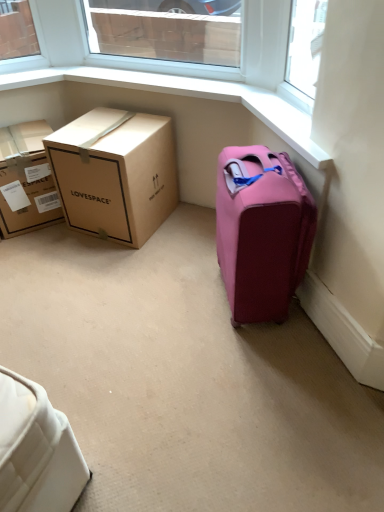
Identify the location of clear glass window at upper center. (166, 33).

Describe the element at coordinates (26, 180) in the screenshot. The width and height of the screenshot is (384, 512). I see `brown cardboard box at left, which appears as the first box when viewed from the left` at that location.

You are a GUI agent. You are given a task and a screenshot of the screen. Output one action in this format:
    pyautogui.click(x=<x>, y=<y>)
    Task: Click on the clear glass window at upper center
    This screenshot has width=384, height=512.
    Given the screenshot: What is the action you would take?
    pyautogui.click(x=166, y=33)

From a real-world perspective, who is located higher, brown cardboard box at left, which is counted as the first box, starting from the right, or pink fabric suitcase at right?

From a 3D spatial view, pink fabric suitcase at right is above.

Based on their positions, is brown cardboard box at left, placed as the second box when sorted from left to right, located to the left or right of pink fabric suitcase at right?

Based on their positions, brown cardboard box at left, placed as the second box when sorted from left to right, is located to the left of pink fabric suitcase at right.

Which of these two, brown cardboard box at left, placed as the second box when sorted from left to right, or pink fabric suitcase at right, is wider?

brown cardboard box at left, placed as the second box when sorted from left to right.

Is brown cardboard box at left, which is counted as the first box, starting from the right, bigger than pink fabric suitcase at right?

Yes, brown cardboard box at left, which is counted as the first box, starting from the right, is bigger than pink fabric suitcase at right.

From the image's perspective, which object appears higher, clear glass window at upper center or brown cardboard box at left, the second box from the right?

clear glass window at upper center is shown above in the image.

Considering the relative positions of clear glass window at upper center and brown cardboard box at left, the second box from the right, in the image provided, is clear glass window at upper center behind brown cardboard box at left, the second box from the right,?

No, clear glass window at upper center is closer to the camera.

Is clear glass window at upper center not within brown cardboard box at left, which appears as the first box when viewed from the left?

clear glass window at upper center is positioned outside brown cardboard box at left, which appears as the first box when viewed from the left.

Between point (232, 6) and point (247, 154), which one is positioned behind?

Point (232, 6)

Is clear glass window at upper center facing towards pink fabric suitcase at right?

No, clear glass window at upper center is not oriented towards pink fabric suitcase at right.

Identify the location of window on the left side of pink fabric suitcase at right. The image size is (384, 512). (166, 33).

Based on the photo, would you consider clear glass window at upper center to be distant from pink fabric suitcase at right?

That's right, there is a large distance between clear glass window at upper center and pink fabric suitcase at right.

Considering the sizes of brown cardboard box at left, the second box from the right, and pink fabric suitcase at right in the image, is brown cardboard box at left, the second box from the right, wider or thinner than pink fabric suitcase at right?

brown cardboard box at left, the second box from the right, is wider than pink fabric suitcase at right.

Which is closer, (39, 183) or (233, 169)?

The point (233, 169) is in front.

Could you tell me if brown cardboard box at left, the second box from the right, is turned towards pink fabric suitcase at right?

No, brown cardboard box at left, the second box from the right, does not turn towards pink fabric suitcase at right.

Which is closer to the camera, (x=148, y=169) or (x=119, y=51)?

Point (x=148, y=169) appears to be closer to the viewer than point (x=119, y=51).

From the picture: Is brown cardboard box at left, placed as the second box when sorted from left to right, bigger or smaller than clear glass window at upper center?

In the image, brown cardboard box at left, placed as the second box when sorted from left to right, appears to be larger than clear glass window at upper center.

Between brown cardboard box at left, placed as the second box when sorted from left to right, and clear glass window at upper center, which one has less height?

Standing shorter between the two is clear glass window at upper center.

Is brown cardboard box at left, placed as the second box when sorted from left to right, facing towards clear glass window at upper center?

No, brown cardboard box at left, placed as the second box when sorted from left to right, is not aimed at clear glass window at upper center.

Which object is further away from the camera, brown cardboard box at left, the second box from the right, or brown cardboard box at left, placed as the second box when sorted from left to right?

brown cardboard box at left, the second box from the right.

Based on the photo, from a real-world perspective, which is physically below, brown cardboard box at left, which appears as the first box when viewed from the left, or brown cardboard box at left, which is counted as the first box, starting from the right?

brown cardboard box at left, which appears as the first box when viewed from the left, is physically lower.

Is brown cardboard box at left, the second box from the right, oriented away from brown cardboard box at left, which is counted as the first box, starting from the right?

brown cardboard box at left, the second box from the right, is not turned away from brown cardboard box at left, which is counted as the first box, starting from the right.

Is point (0, 209) less distant than point (58, 179)?

No, (0, 209) is behind (58, 179).

Between pink fabric suitcase at right and clear glass window at upper center, which one has more height?

pink fabric suitcase at right.

Can you confirm if pink fabric suitcase at right is positioned to the right of clear glass window at upper center?

Correct, you'll find pink fabric suitcase at right to the right of clear glass window at upper center.

Can clear glass window at upper center be found inside pink fabric suitcase at right?

No, clear glass window at upper center is not a part of pink fabric suitcase at right.

Is pink fabric suitcase at right bigger than clear glass window at upper center?

Correct, pink fabric suitcase at right is larger in size than clear glass window at upper center.

Where is `the 1st box above when counting from the pink fabric suitcase at right (from the image's perspective)`? the 1st box above when counting from the pink fabric suitcase at right (from the image's perspective) is located at coordinates (115, 173).

You are a GUI agent. You are given a task and a screenshot of the screen. Output one action in this format:
    pyautogui.click(x=<x>, y=<y>)
    Task: Click on the 2nd box below the clear glass window at upper center (from a real-world perspective)
    Image resolution: width=384 pixels, height=512 pixels.
    Given the screenshot: What is the action you would take?
    [26, 180]

Which object lies nearer to the anchor point brown cardboard box at left, placed as the second box when sorted from left to right, brown cardboard box at left, the second box from the right, or pink fabric suitcase at right?

Among the two, brown cardboard box at left, the second box from the right, is located nearer to brown cardboard box at left, placed as the second box when sorted from left to right.

Estimate the real-world distances between objects in this image. Which object is further from clear glass window at upper center, brown cardboard box at left, placed as the second box when sorted from left to right, or brown cardboard box at left, which appears as the first box when viewed from the left?

brown cardboard box at left, placed as the second box when sorted from left to right, is further to clear glass window at upper center.

Consider the image. Which object lies further to the anchor point brown cardboard box at left, the second box from the right, brown cardboard box at left, which is counted as the first box, starting from the right, or pink fabric suitcase at right?

pink fabric suitcase at right is further to brown cardboard box at left, the second box from the right.

Which object lies nearer to the anchor point brown cardboard box at left, the second box from the right, pink fabric suitcase at right or clear glass window at upper center?

pink fabric suitcase at right is positioned closer to the anchor brown cardboard box at left, the second box from the right.

Consider the image. Estimate the real-world distances between objects in this image. Which object is further from clear glass window at upper center, pink fabric suitcase at right or brown cardboard box at left, which appears as the first box when viewed from the left?

pink fabric suitcase at right.

When comparing their distances from clear glass window at upper center, does brown cardboard box at left, which is counted as the first box, starting from the right, or pink fabric suitcase at right seem closer?

brown cardboard box at left, which is counted as the first box, starting from the right, is closer to clear glass window at upper center.

From the image, which object appears to be farther from brown cardboard box at left, the second box from the right, brown cardboard box at left, which is counted as the first box, starting from the right, or clear glass window at upper center?

Based on the image, clear glass window at upper center appears to be further to brown cardboard box at left, the second box from the right.

Based on their spatial positions, is brown cardboard box at left, which appears as the first box when viewed from the left, or clear glass window at upper center further from pink fabric suitcase at right?

clear glass window at upper center lies further to pink fabric suitcase at right than the other object.

I want to click on window between brown cardboard box at left, the second box from the right, and pink fabric suitcase at right from left to right, so click(166, 33).

You are a GUI agent. You are given a task and a screenshot of the screen. Output one action in this format:
    pyautogui.click(x=<x>, y=<y>)
    Task: Click on the box between brown cardboard box at left, which appears as the first box when viewed from the left, and pink fabric suitcase at right
    
    Given the screenshot: What is the action you would take?
    pyautogui.click(x=115, y=173)

I want to click on box that lies between clear glass window at upper center and brown cardboard box at left, placed as the second box when sorted from left to right, from top to bottom, so click(26, 180).